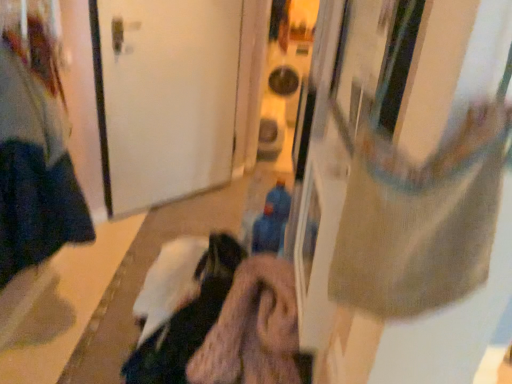
Question: From the image's perspective, would you say dark blue fabric at left is shown under white matte door at center?

Choices:
 (A) yes
 (B) no

Answer: (A)

Question: Can you confirm if dark blue fabric at left is shorter than white matte door at center?

Choices:
 (A) no
 (B) yes

Answer: (B)

Question: Is dark blue fabric at left closer to the viewer compared to white matte door at center?

Choices:
 (A) yes
 (B) no

Answer: (A)

Question: Is dark blue fabric at left to the left of white matte door at center from the viewer's perspective?

Choices:
 (A) no
 (B) yes

Answer: (B)

Question: Is white matte door at center a part of dark blue fabric at left?

Choices:
 (A) yes
 (B) no

Answer: (B)

Question: Is dark blue fabric at left smaller than white matte door at center?

Choices:
 (A) no
 (B) yes

Answer: (A)

Question: Is the depth of blue fabric toy at center less than that of dark blue fabric at left?

Choices:
 (A) no
 (B) yes

Answer: (A)

Question: Does blue fabric toy at center lie behind dark blue fabric at left?

Choices:
 (A) yes
 (B) no

Answer: (A)

Question: Can you confirm if blue fabric toy at center is shorter than dark blue fabric at left?

Choices:
 (A) no
 (B) yes

Answer: (B)

Question: Is blue fabric toy at center far away from dark blue fabric at left?

Choices:
 (A) no
 (B) yes

Answer: (A)

Question: From a real-world perspective, is blue fabric toy at center physically below dark blue fabric at left?

Choices:
 (A) yes
 (B) no

Answer: (A)

Question: Can you confirm if blue fabric toy at center is taller than dark blue fabric at left?

Choices:
 (A) no
 (B) yes

Answer: (A)

Question: Is white matte door at center placed right next to blue fabric toy at center?

Choices:
 (A) no
 (B) yes

Answer: (A)